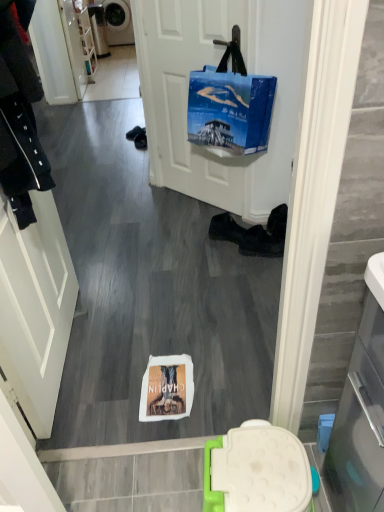
The height and width of the screenshot is (512, 384). I want to click on empty space that is in between black leather shoes at center, acting as the 2th footwear starting from the right, and white paper bag at center, so click(193, 298).